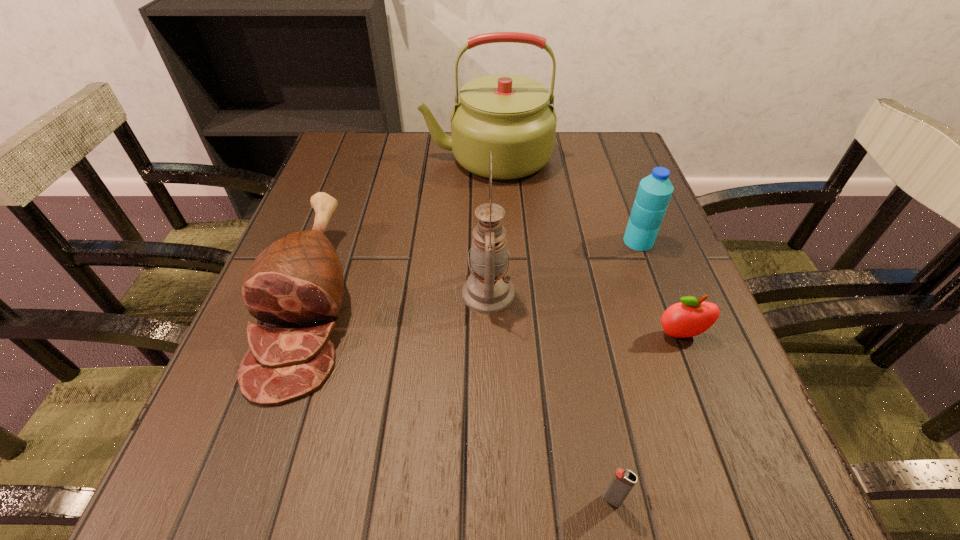
At what (x,y) coordinates should I click in order to perform the action: click on vacant region between the nearest object and the ham. Please return your answer as a coordinate pair (x, y). This screenshot has height=540, width=960. Looking at the image, I should click on (461, 400).

This screenshot has width=960, height=540. What are the coordinates of `free space between the apple and the fourth shortest object` in the screenshot? It's located at (660, 288).

At what (x,y) coordinates should I click in order to perform the action: click on free space between the second shortest object and the leftmost object. Please return your answer as a coordinate pair (x, y). Looking at the image, I should click on (495, 318).

Image resolution: width=960 pixels, height=540 pixels. In order to click on vacant point located between the third shortest object and the igniter in this screenshot , I will do `click(461, 400)`.

Identify the location of free point between the water bottle and the farthest object. (563, 199).

Identify which object is located as the third nearest to the farthest object. Please provide its 2D coordinates. Your answer should be formatted as a tuple, i.e. [(x, y)], where the tuple contains the x and y coordinates of a point satisfying the conditions above.

[(488, 290)]

Identify which object is located as the fifth nearest to the farthest object. Please provide its 2D coordinates. Your answer should be formatted as a tuple, i.e. [(x, y)], where the tuple contains the x and y coordinates of a point satisfying the conditions above.

[(623, 481)]

Image resolution: width=960 pixels, height=540 pixels. Find the location of `vacant space that satisfies the following two spatial constraints: 1. at the sliced end of the shortest object; 2. on the left side of the ham`. vacant space that satisfies the following two spatial constraints: 1. at the sliced end of the shortest object; 2. on the left side of the ham is located at coordinates (239, 500).

What are the coordinates of `blank area in the image that satisfies the following two spatial constraints: 1. on the back side of the nearest object; 2. on the left side of the second shortest object` in the screenshot? It's located at (580, 335).

The image size is (960, 540). I want to click on vacant space that satisfies the following two spatial constraints: 1. at the spout of the kettle; 2. on the left side of the third tallest object, so click(x=489, y=241).